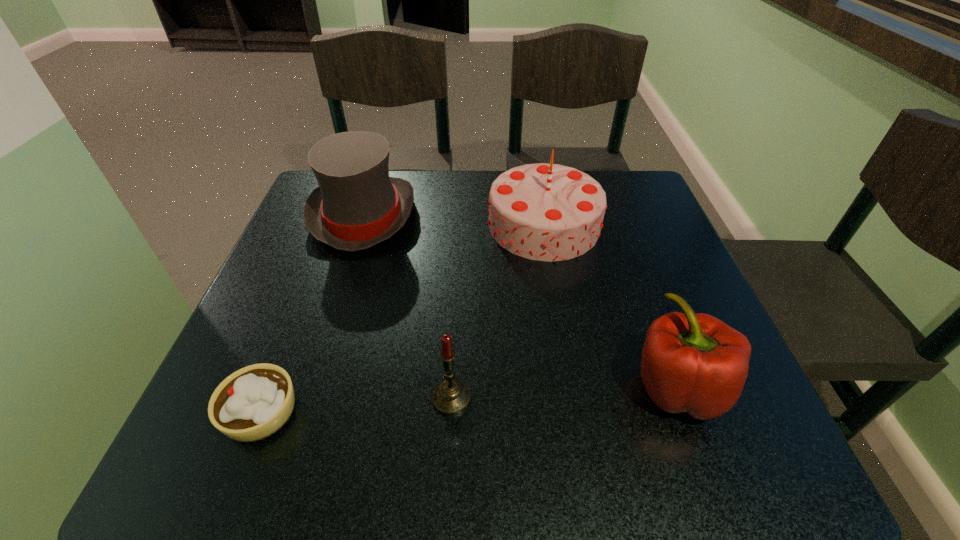
Identify the location of vacant region between the dress hat and the birthday cake. Image resolution: width=960 pixels, height=540 pixels. (454, 220).

Image resolution: width=960 pixels, height=540 pixels. Identify the location of free spot between the bell pepper and the birthday cake. (611, 306).

At what (x,y) coordinates should I click in order to perform the action: click on free space between the bell pepper and the candle. Please return your answer as a coordinate pair (x, y). This screenshot has height=540, width=960. Looking at the image, I should click on (564, 393).

Identify the location of free space between the dress hat and the birthday cake. The height and width of the screenshot is (540, 960). (454, 220).

Locate an element on the screen. This screenshot has height=540, width=960. free space between the bell pepper and the dress hat is located at coordinates (520, 301).

Locate an element on the screen. unoccupied position between the bell pepper and the third object from right to left is located at coordinates (564, 393).

Where is `free space between the birthday cake and the bell pepper`? free space between the birthday cake and the bell pepper is located at coordinates (611, 306).

The image size is (960, 540). I want to click on vacant area that lies between the candle and the dress hat, so (407, 307).

Point out which object is positioned as the fourth nearest to the candle. Please provide its 2D coordinates. Your answer should be formatted as a tuple, i.e. [(x, y)], where the tuple contains the x and y coordinates of a point satisfying the conditions above.

[(357, 205)]

This screenshot has height=540, width=960. Find the location of `object that can be found as the fourth closest to the bell pepper`. object that can be found as the fourth closest to the bell pepper is located at coordinates (254, 402).